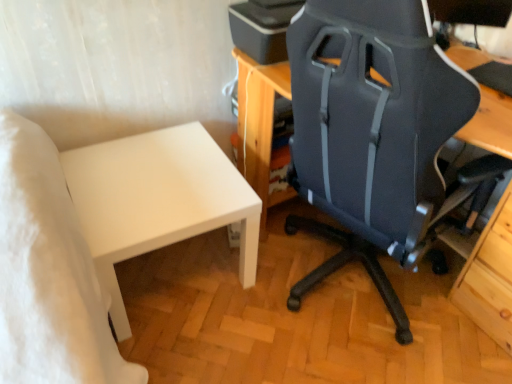
Question: From the image's perspective, does matte black printer at upper center appear lower than matte black chair at center?

Choices:
 (A) yes
 (B) no

Answer: (B)

Question: Is matte black printer at upper center oriented away from matte black chair at center?

Choices:
 (A) yes
 (B) no

Answer: (B)

Question: Is matte black printer at upper center to the right of matte black chair at center from the viewer's perspective?

Choices:
 (A) yes
 (B) no

Answer: (B)

Question: Does matte black printer at upper center appear on the left side of matte black chair at center?

Choices:
 (A) no
 (B) yes

Answer: (B)

Question: Is matte black printer at upper center wider than matte black chair at center?

Choices:
 (A) no
 (B) yes

Answer: (A)

Question: Can you see matte black printer at upper center touching matte black chair at center?

Choices:
 (A) no
 (B) yes

Answer: (A)

Question: Is matte black chair at center positioned before white matte table at lower left?

Choices:
 (A) no
 (B) yes

Answer: (B)

Question: Is matte black chair at center positioned behind white matte table at lower left?

Choices:
 (A) no
 (B) yes

Answer: (A)

Question: From the image's perspective, is matte black chair at center on top of white matte table at lower left?

Choices:
 (A) no
 (B) yes

Answer: (B)

Question: From a real-world perspective, is matte black chair at center over white matte table at lower left?

Choices:
 (A) no
 (B) yes

Answer: (B)

Question: Is white matte table at lower left located within matte black chair at center?

Choices:
 (A) yes
 (B) no

Answer: (B)

Question: Can you confirm if matte black chair at center is taller than white matte table at lower left?

Choices:
 (A) yes
 (B) no

Answer: (A)

Question: From the image's perspective, does matte black printer at upper center appear lower than white matte table at lower left?

Choices:
 (A) no
 (B) yes

Answer: (A)